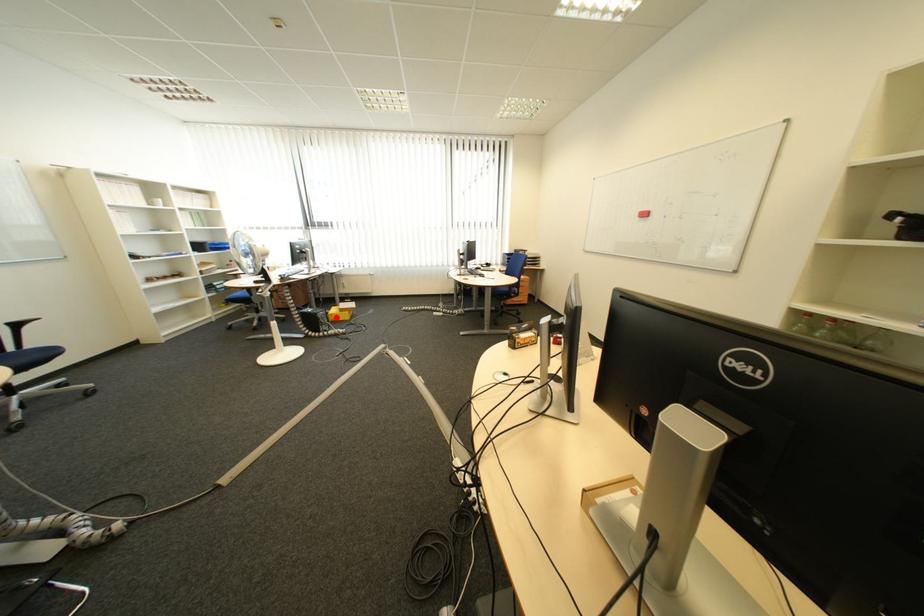
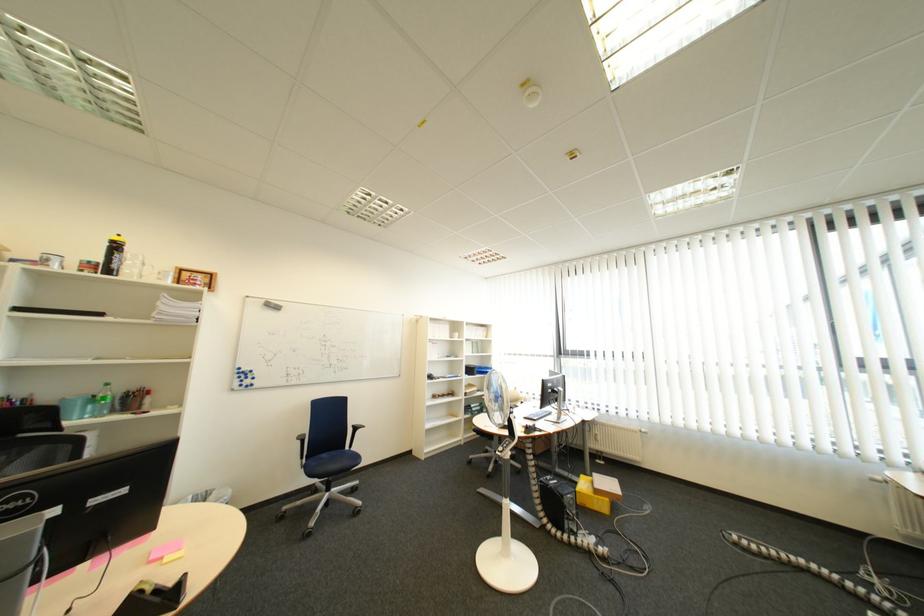
Question: I am providing you with two images of the same scene from different viewpoints. A red point is shown in image1. For the corresponding object point in image2, is it positioned nearer or farther from the camera?

Choices:
 (A) Nearer
 (B) Farther

Answer: (B)